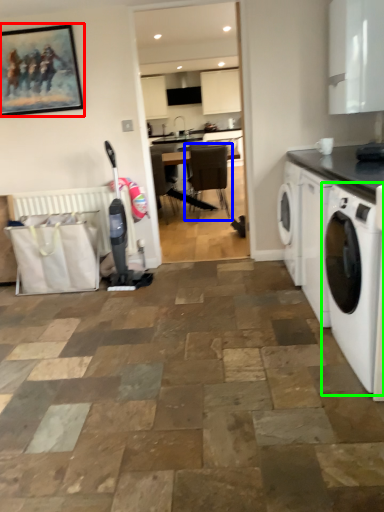
Question: Estimate the real-world distances between objects in this image. Which object is closer to picture frame (highlighted by a red box), chair (highlighted by a blue box) or washing machine (highlighted by a green box)?

Choices:
 (A) chair
 (B) washing machine

Answer: (B)